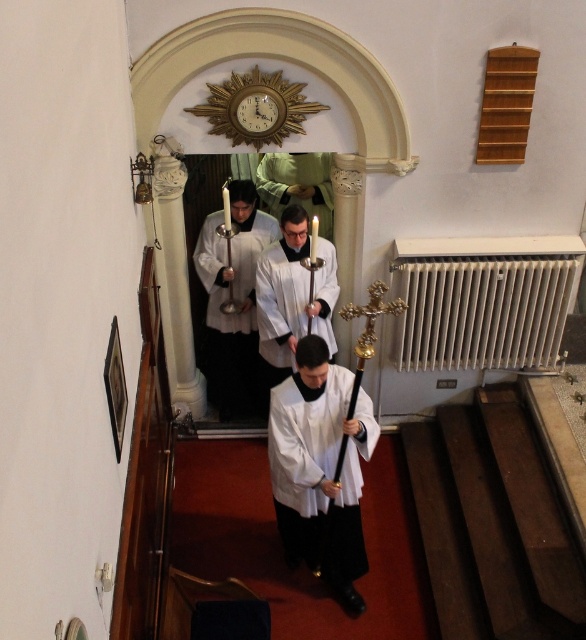
Question: Among these objects, which one is farthest from the camera?

Choices:
 (A) white matte/soft fabric at center
 (B) white glossy robe at center
 (C) white metallic radiator at right
 (D) white matte vestment at center

Answer: (C)

Question: Can you confirm if white matte/soft fabric at center is positioned above white glossy robe at center?

Choices:
 (A) no
 (B) yes

Answer: (A)

Question: Can you confirm if white matte/soft fabric at center is thinner than white glossy robe at center?

Choices:
 (A) yes
 (B) no

Answer: (A)

Question: From the image, what is the correct spatial relationship of white metallic radiator at right in relation to white matte vestment at center?

Choices:
 (A) below
 (B) above

Answer: (B)

Question: Estimate the real-world distances between objects in this image. Which object is farther from the white glossy robe at center?

Choices:
 (A) white metallic radiator at right
 (B) white matte vestment at center
 (C) white matte/soft fabric at center

Answer: (A)

Question: Which of the following is the farthest from the observer?

Choices:
 (A) white metallic radiator at right
 (B) white matte/soft fabric at center

Answer: (A)